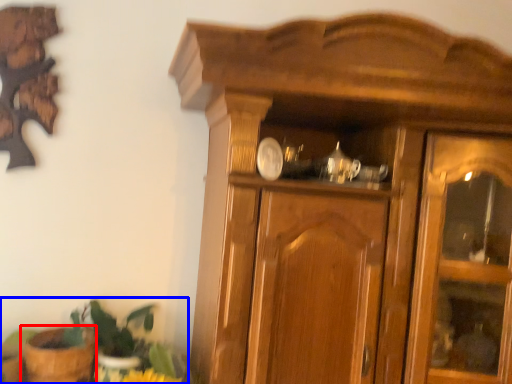
Question: Which object is further to the camera taking this photo, flowerpot (highlighted by a red box) or houseplant (highlighted by a blue box)?

Choices:
 (A) flowerpot
 (B) houseplant

Answer: (B)